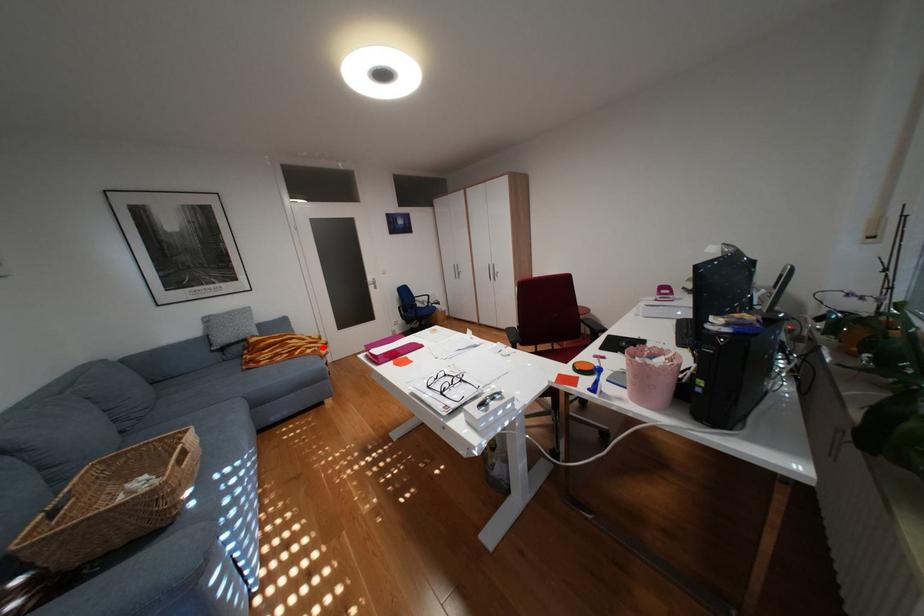
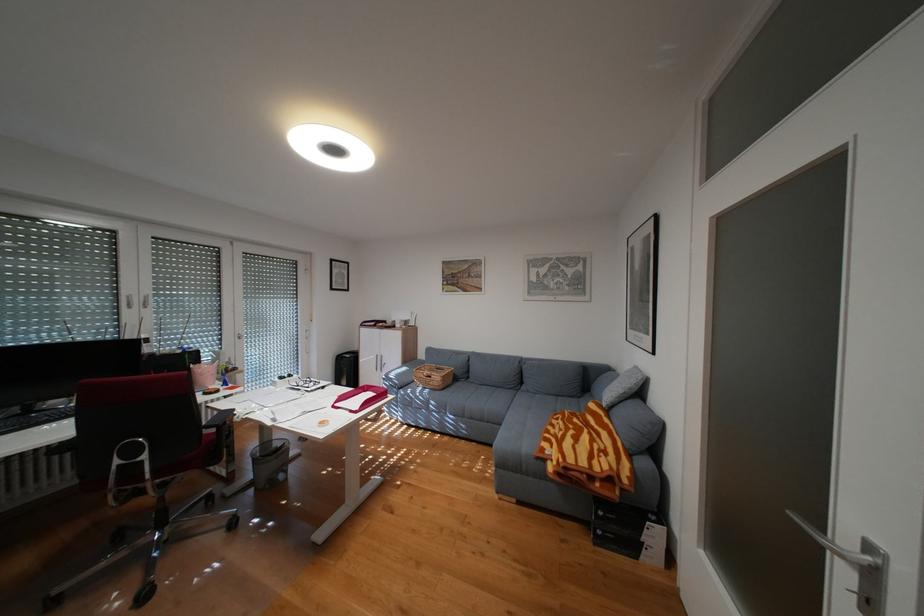
The point at the highlighted location is marked in the first image. Where is the corresponding point in the second image?

(564, 445)